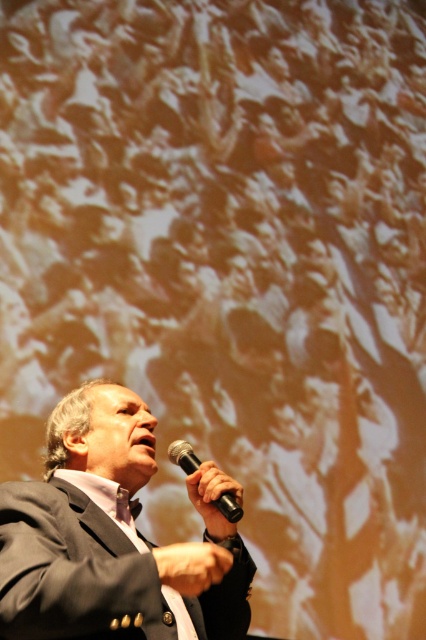
Image resolution: width=426 pixels, height=640 pixels. What do you see at coordinates (112, 538) in the screenshot?
I see `dark gray suit at center` at bounding box center [112, 538].

Which is more to the left, dark gray suit at center or black matte microphone at center?

From the viewer's perspective, dark gray suit at center appears more on the left side.

What do you see at coordinates (112, 538) in the screenshot? I see `dark gray suit at center` at bounding box center [112, 538].

Identify the location of dark gray suit at center. (112, 538).